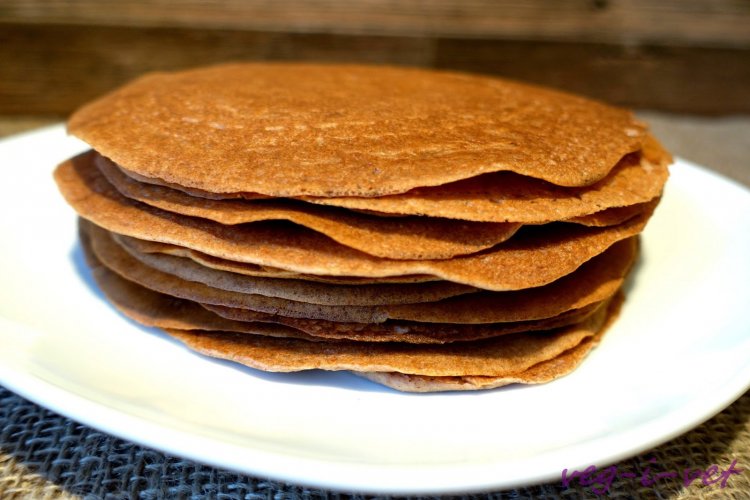
Identify the location of plate. Image resolution: width=750 pixels, height=500 pixels. (637, 389).